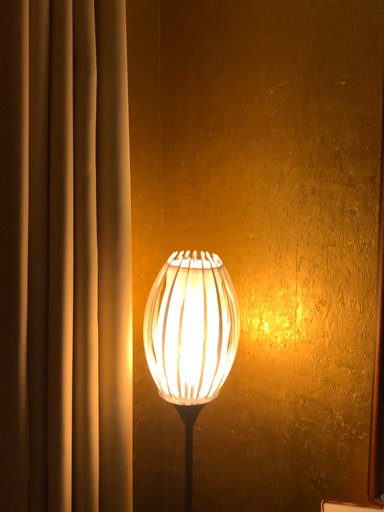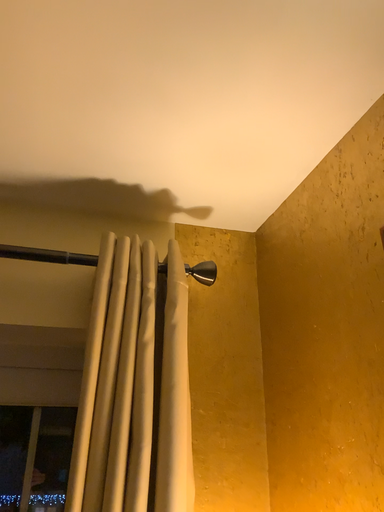
Question: Which way did the camera rotate in the video?

Choices:
 (A) rotated upward
 (B) rotated downward

Answer: (A)